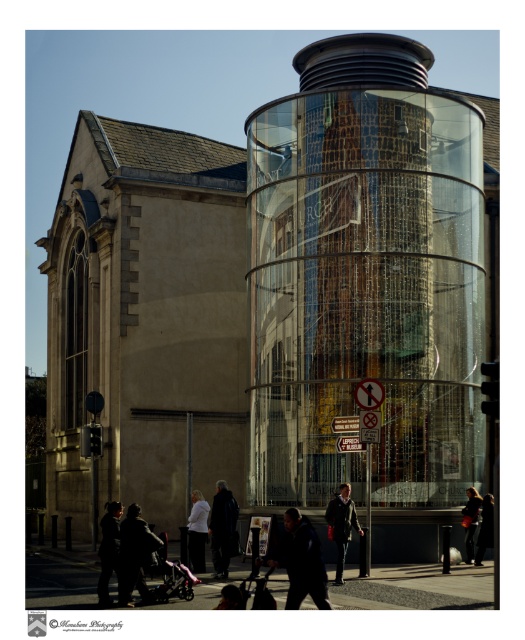
You are standing in front of the modern architectural structure and want to take a photo of both the beige stone church at center and the dark blue coat at center. Which object will appear larger in the photo?

The beige stone church at center will appear larger in the photo because it is taller than the dark blue coat at center.

You are an observer standing in front of the modern glass church structure. You notice a white cotton shirt at lower center and a dark blue jacket at lower right. Which clothing item is positioned higher relative to the other?

The white cotton shirt at lower center is located above the dark blue jacket at lower right, so it is positioned higher.

You are an event organizer planning to seat guests in the modern glass structure. You have two jackets, the dark gray jacket at lower left and the dark blue jacket at lower right. Which jacket has a larger width and would require more space on the seating bench?

The dark gray jacket at lower left has a larger width than the dark blue jacket at lower right, so it would require more space on the seating bench.